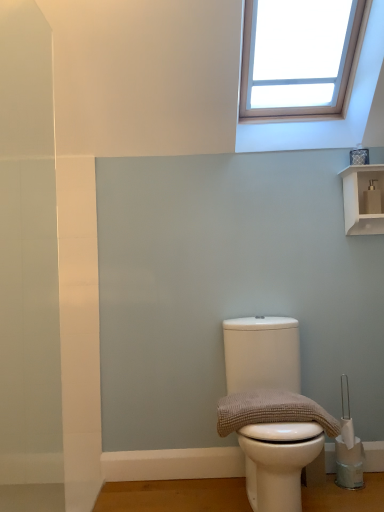
What is the approximate width of white matte toilet at center?

The width of white matte toilet at center is 25.32 inches.

The height and width of the screenshot is (512, 384). Identify the location of white matte toilet at center. (278, 461).

Is point (252, 434) behind point (288, 402)?

No, it is not.

Which is in front, white matte toilet at center or brown textured towel at center?

white matte toilet at center is more forward.

How much distance is there between white matte toilet at center and brown textured towel at center?

white matte toilet at center is 12.25 centimeters from brown textured towel at center.

Where is `material on the left of white matte toilet at center`? Image resolution: width=384 pixels, height=512 pixels. material on the left of white matte toilet at center is located at coordinates (271, 411).

Which object is positioned more to the left, white glossy shelf at upper right or white matte toilet at center?

Positioned to the left is white matte toilet at center.

From a real-world perspective, is white glossy shelf at upper right under white matte toilet at center?

No.

From the image's perspective, is white glossy shelf at upper right under white matte toilet at center?

No.

Between white glossy shelf at upper right and white matte toilet at center, which one has larger width?

white matte toilet at center.

Is brown textured towel at center turned away from white matte toilet at center?

That's right, brown textured towel at center is facing away from white matte toilet at center.

How different are the orientations of brown textured towel at center and white matte toilet at center in degrees?

They differ by 0.000273 degrees in their facing directions.

Which is in front, brown textured towel at center or white matte toilet at center?

white matte toilet at center is in front.

Is white matte toilet at center at the left side of white glossy shelf at upper right?

Indeed, white matte toilet at center is positioned on the left side of white glossy shelf at upper right.

Would you say white matte toilet at center is inside or outside white glossy shelf at upper right?

white matte toilet at center is located beyond the bounds of white glossy shelf at upper right.

From the image's perspective, is white matte toilet at center located above white glossy shelf at upper right?

No, from the image's perspective, white matte toilet at center is not above white glossy shelf at upper right.

Is white matte toilet at center wider than white glossy shelf at upper right?

Correct, the width of white matte toilet at center exceeds that of white glossy shelf at upper right.

Considering the positions of point (220, 411) and point (351, 197), is point (220, 411) closer or farther from the camera than point (351, 197)?

Clearly, point (220, 411) is closer to the camera than point (351, 197).

Is brown textured towel at center placed right next to white glossy shelf at upper right?

No, brown textured towel at center is not in contact with white glossy shelf at upper right.

Is brown textured towel at center positioned beyond the bounds of white glossy shelf at upper right?

Indeed, brown textured towel at center is completely outside white glossy shelf at upper right.

From the image's perspective, which is below, brown textured towel at center or white glossy shelf at upper right?

brown textured towel at center.

In terms of width, does white glossy shelf at upper right look wider or thinner when compared to brown textured towel at center?

Clearly, white glossy shelf at upper right has less width compared to brown textured towel at center.

Does white glossy shelf at upper right come in front of brown textured towel at center?

No, it is behind brown textured towel at center.

From their relative heights in the image, would you say white glossy shelf at upper right is taller or shorter than brown textured towel at center?

In the image, white glossy shelf at upper right appears to be taller than brown textured towel at center.

Is white glossy shelf at upper right not close to brown textured towel at center?

white glossy shelf at upper right is far away from brown textured towel at center.

This screenshot has width=384, height=512. I want to click on material above the white matte toilet at center (from a real-world perspective), so coord(271,411).

Identify the location of toilet on the left of the white glossy shelf at upper right. point(278,461).

Looking at the image, which one is located closer to white matte toilet at center, white glossy shelf at upper right or brown textured towel at center?

Among the two, brown textured towel at center is located nearer to white matte toilet at center.

Consider the image. Which object lies further to the anchor point white matte toilet at center, brown textured towel at center or white glossy shelf at upper right?

Based on the image, white glossy shelf at upper right appears to be further to white matte toilet at center.

Which object lies nearer to the anchor point white glossy shelf at upper right, white matte toilet at center or brown textured towel at center?

brown textured towel at center is closer to white glossy shelf at upper right.

When comparing their distances from white glossy shelf at upper right, does brown textured towel at center or white matte toilet at center seem closer?

brown textured towel at center.

Considering their positions, is white glossy shelf at upper right positioned further to brown textured towel at center than white matte toilet at center?

white glossy shelf at upper right lies further to brown textured towel at center than the other object.

Which object lies nearer to the anchor point brown textured towel at center, white matte toilet at center or white glossy shelf at upper right?

The object closer to brown textured towel at center is white matte toilet at center.

At what (x,y) coordinates should I click in order to perform the action: click on material that lies between white glossy shelf at upper right and white matte toilet at center from top to bottom. Please return your answer as a coordinate pair (x, y). This screenshot has width=384, height=512. Looking at the image, I should click on coord(271,411).